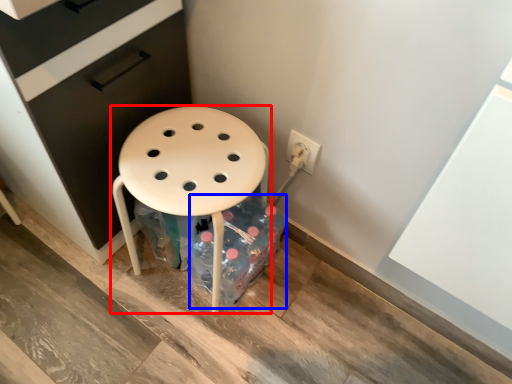
Question: Which object is closer to the camera taking this photo, stool (highlighted by a red box) or bottle (highlighted by a blue box)?

Choices:
 (A) stool
 (B) bottle

Answer: (A)